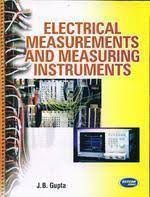
What are the coordinates of `screen` in the screenshot? It's located at (99, 146).